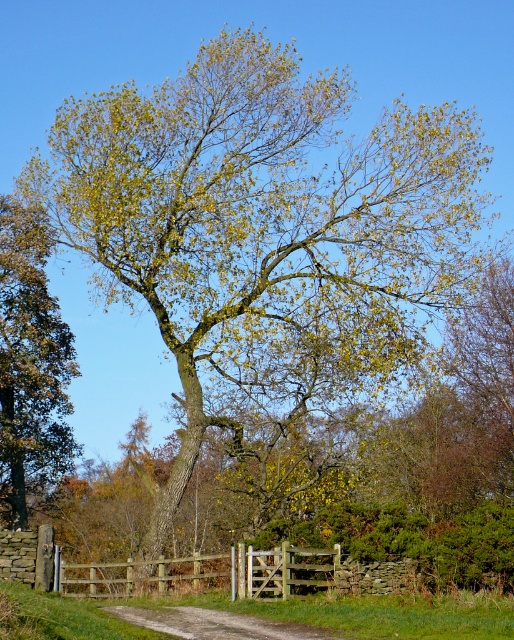
Question: Which object is closer to the camera taking this photo?

Choices:
 (A) green leafy tree at left
 (B) wooden gate at center
 (C) dirt/gravel path at center

Answer: (C)

Question: Does wooden gate at center have a larger size compared to dirt/gravel path at center?

Choices:
 (A) yes
 (B) no

Answer: (A)

Question: Which point is closer to the camera?

Choices:
 (A) (322, 632)
 (B) (36, 472)
 (C) (338, 563)

Answer: (A)

Question: Is green leafy tree at left in front of wooden gate at center?

Choices:
 (A) no
 (B) yes

Answer: (A)

Question: Considering the real-world distances, which object is farthest from the green leafy tree at left?

Choices:
 (A) wooden gate at center
 (B) dirt/gravel path at center

Answer: (B)

Question: Does green leafy tree at left have a greater width compared to dirt/gravel path at center?

Choices:
 (A) yes
 (B) no

Answer: (A)